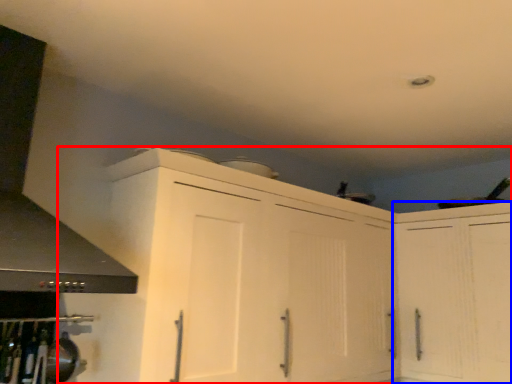
Question: Among these objects, which one is nearest to the camera, cabinetry (highlighted by a red box) or cabinetry (highlighted by a blue box)?

Choices:
 (A) cabinetry
 (B) cabinetry

Answer: (A)